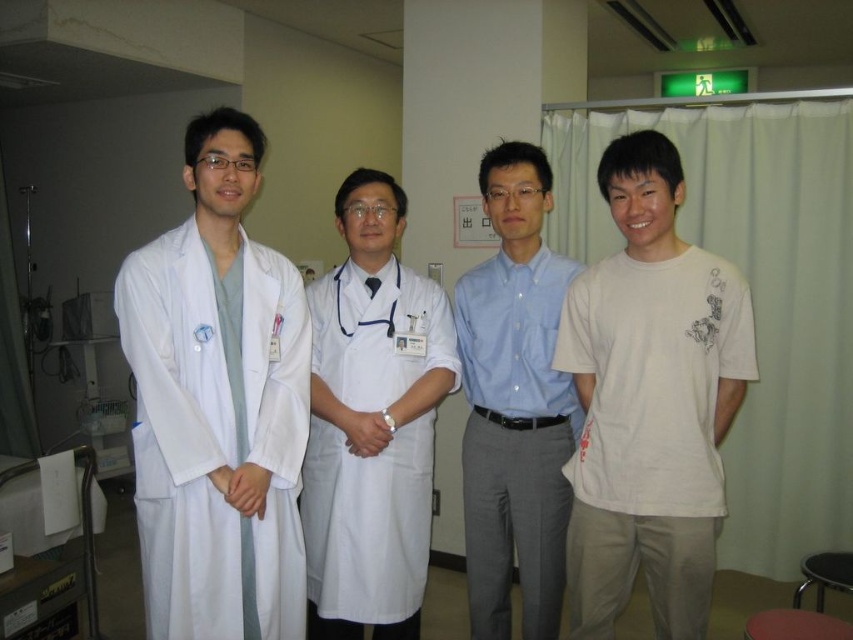
Based on the photo, can you confirm if white matte lab coat at left is positioned below white cotton t-shirt at right?

Incorrect, white matte lab coat at left is not positioned below white cotton t-shirt at right.

Identify the location of white matte lab coat at left. (218, 404).

Can you confirm if white matte lab coat at left is smaller than white matte lab coat at center?

Indeed, white matte lab coat at left has a smaller size compared to white matte lab coat at center.

At what (x,y) coordinates should I click in order to perform the action: click on white matte lab coat at left. Please return your answer as a coordinate pair (x, y). This screenshot has height=640, width=853. Looking at the image, I should click on (218, 404).

Identify the location of white matte lab coat at left. The height and width of the screenshot is (640, 853). (218, 404).

Is light blue button-down shirt at center to the left of white fabric stethoscope at center from the viewer's perspective?

Incorrect, light blue button-down shirt at center is not on the left side of white fabric stethoscope at center.

This screenshot has height=640, width=853. What do you see at coordinates (514, 403) in the screenshot?
I see `light blue button-down shirt at center` at bounding box center [514, 403].

Where is `light blue button-down shirt at center`? This screenshot has height=640, width=853. light blue button-down shirt at center is located at coordinates (514, 403).